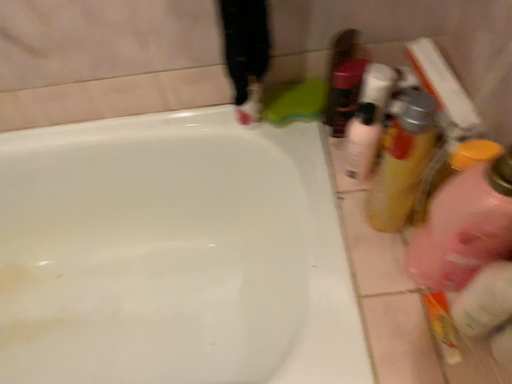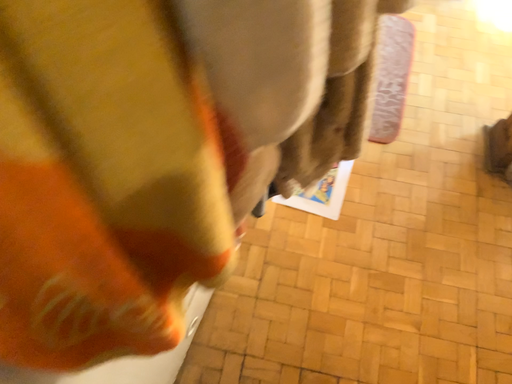
Question: How did the camera likely rotate when shooting the video?

Choices:
 (A) rotated upward
 (B) rotated downward

Answer: (A)